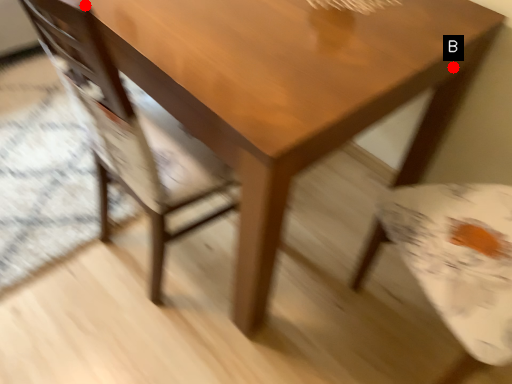
Question: Two points are circled on the image, labeled by A and B beside each circle. Which point is closer to the camera taking this photo?

Choices:
 (A) A is closer
 (B) B is closer

Answer: (A)